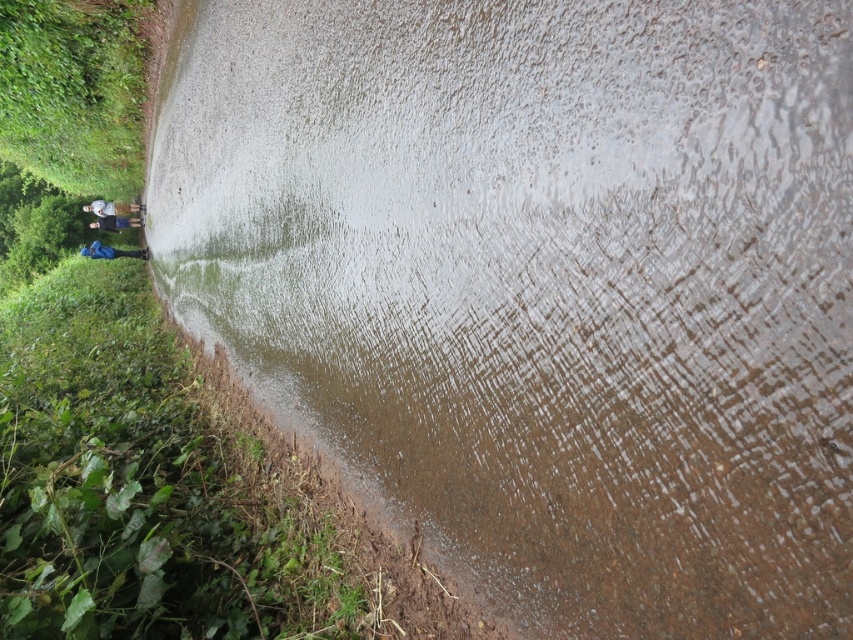
Question: Does blue fabric pants at left have a larger size compared to blue fabric backpack at left?

Choices:
 (A) yes
 (B) no

Answer: (A)

Question: Can you confirm if blue fabric pants at left is positioned above blue fabric backpack at left?

Choices:
 (A) no
 (B) yes

Answer: (B)

Question: Is blue fabric pants at left positioned in front of blue fabric backpack at left?

Choices:
 (A) no
 (B) yes

Answer: (A)

Question: Which point is farther from the camera taking this photo?

Choices:
 (A) (90, 248)
 (B) (119, 205)

Answer: (B)

Question: Which object is closer to the camera taking this photo?

Choices:
 (A) blue fabric pants at left
 (B) blue fabric backpack at left

Answer: (B)